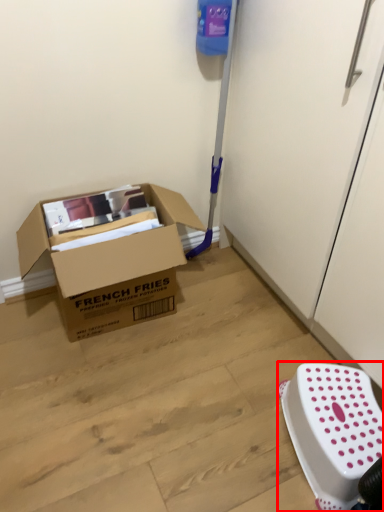
Question: Where is stool (annotated by the red box) located in relation to box in the image?

Choices:
 (A) left
 (B) right

Answer: (B)